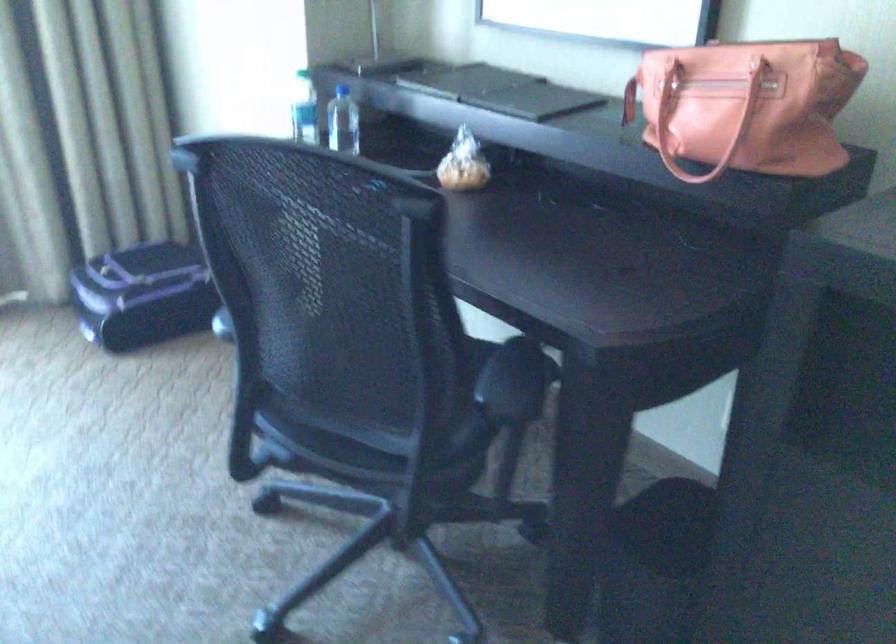
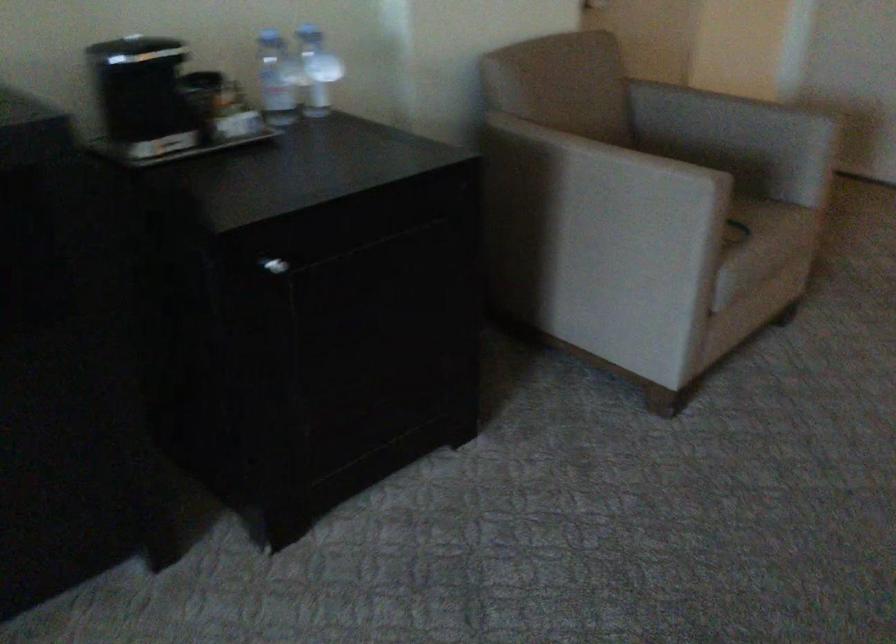
How did the camera likely rotate?

The rotation direction of the camera is right-down.